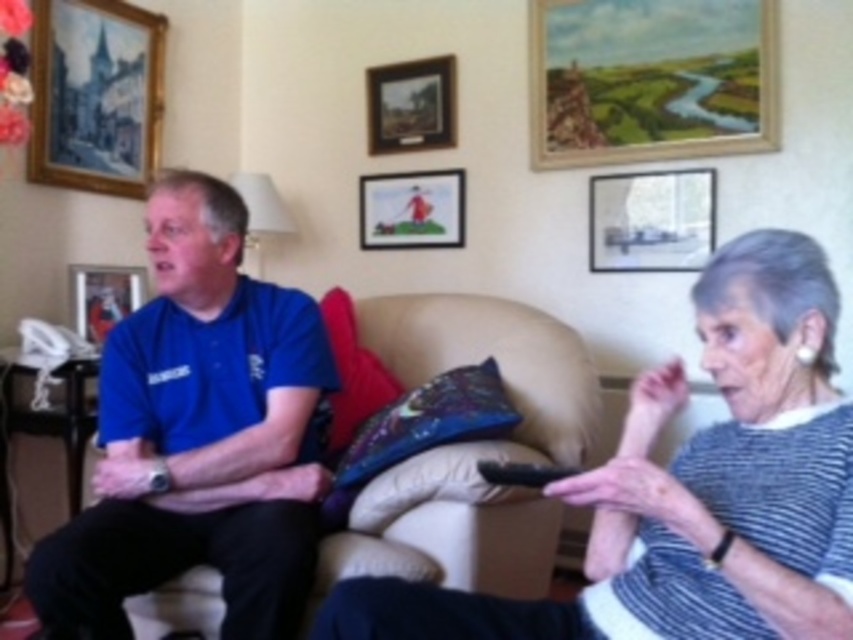
You are standing in the living room and need to place a small plant between the two points, point (x=618, y=180) and point (x=405, y=195). Which point should the plant be closer to in order to be positioned in front of the other point?

The plant should be closer to point (x=618, y=180) because it is in front of point (x=405, y=195).

You are a decorator trying to hang two new frames in a living room. The existing frames include the matte wooden picture frame at upper right and the matte plastic picture frame at upper center. If your new frames are 24 inches wide, will they fit between the two existing frames without overlapping?

The distance between the matte wooden picture frame at upper right and the matte plastic picture frame at upper center is 25.31 inches. Since the new frames are 24 inches wide, they can fit between them without overlapping as there is enough space.

You are a delivery person standing at the entrance of the living room. You need to place a package on the beige fabric couch at center. Can you reach the couch from your current position?

The beige fabric couch at center and viewer are 5.96 feet apart, so yes, the delivery person can reach the couch from their current position as the distance is manageable for placing the package.